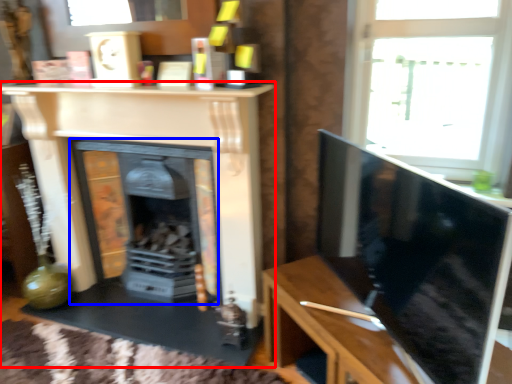
Question: Which object appears farthest to the camera in this image, fireplace (highlighted by a red box) or fireplace (highlighted by a blue box)?

Choices:
 (A) fireplace
 (B) fireplace

Answer: (B)